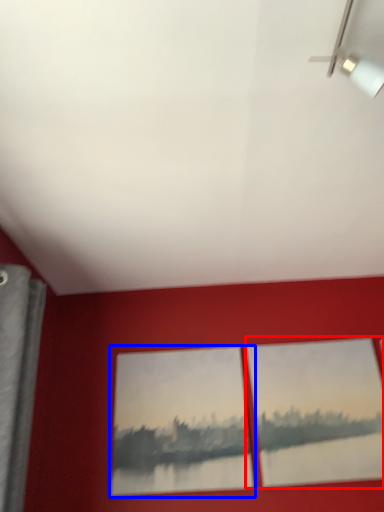
Question: Among these objects, which one is farthest to the camera, picture frame (highlighted by a red box) or picture frame (highlighted by a blue box)?

Choices:
 (A) picture frame
 (B) picture frame

Answer: (B)